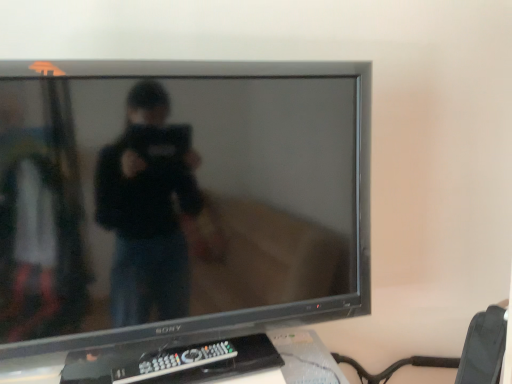
Locate an element on the screen. black plastic remote at lower center is located at coordinates (173, 362).

This screenshot has height=384, width=512. Describe the element at coordinates (173, 362) in the screenshot. I see `black plastic remote at lower center` at that location.

You are a GUI agent. You are given a task and a screenshot of the screen. Output one action in this format:
    pyautogui.click(x=<x>, y=<y>)
    Task: Click on the satin black tv at center
    
    Given the screenshot: What is the action you would take?
    pyautogui.click(x=180, y=215)

This screenshot has height=384, width=512. What do you see at coordinates (180, 215) in the screenshot?
I see `satin black tv at center` at bounding box center [180, 215].

Locate an element on the screen. The height and width of the screenshot is (384, 512). black plastic remote at lower center is located at coordinates (173, 362).

Between black plastic remote at lower center and satin black tv at center, which one appears on the right side from the viewer's perspective?

satin black tv at center is more to the right.

Which object is more forward, black plastic remote at lower center or satin black tv at center?

satin black tv at center is in front.

Does point (212, 354) lie in front of point (103, 230)?

No, (212, 354) is behind (103, 230).

From the image's perspective, relative to satin black tv at center, is black plastic remote at lower center above or below?

Clearly, from the image's perspective, black plastic remote at lower center is below satin black tv at center.

From a real-world perspective, who is located higher, black plastic remote at lower center or satin black tv at center?

satin black tv at center is physically above.

Considering the relative sizes of black plastic remote at lower center and satin black tv at center in the image provided, is black plastic remote at lower center wider than satin black tv at center?

In fact, black plastic remote at lower center might be narrower than satin black tv at center.

Is black plastic remote at lower center shorter than satin black tv at center?

Yes.

Considering the sizes of objects black plastic remote at lower center and satin black tv at center in the image provided, who is smaller, black plastic remote at lower center or satin black tv at center?

black plastic remote at lower center is smaller.

Is satin black tv at center inside black plastic remote at lower center?

No, satin black tv at center is located outside of black plastic remote at lower center.

Are black plastic remote at lower center and satin black tv at center far apart?

No, black plastic remote at lower center is not far away from satin black tv at center.

Is black plastic remote at lower center facing towards satin black tv at center?

Yes, black plastic remote at lower center is turned towards satin black tv at center.

Where is `remote control that appears below the satin black tv at center (from a real-world perspective)`? The height and width of the screenshot is (384, 512). remote control that appears below the satin black tv at center (from a real-world perspective) is located at coordinates (173, 362).

Between satin black tv at center and black plastic remote at lower center, which one appears on the right side from the viewer's perspective?

Positioned to the right is satin black tv at center.

Which object is more forward, satin black tv at center or black plastic remote at lower center?

satin black tv at center is more forward.

Is point (144, 193) closer to viewer compared to point (207, 354)?

Yes, point (144, 193) is closer to viewer.

From the image's perspective, between satin black tv at center and black plastic remote at lower center, which one is located above?

satin black tv at center appears higher in the image.

From a real-world perspective, is satin black tv at center on top of black plastic remote at lower center?

Correct, in the physical world, satin black tv at center is higher than black plastic remote at lower center.

Which object is thinner, satin black tv at center or black plastic remote at lower center?

Thinner between the two is black plastic remote at lower center.

Is satin black tv at center shorter than black plastic remote at lower center?

In fact, satin black tv at center may be taller than black plastic remote at lower center.

Is satin black tv at center bigger or smaller than black plastic remote at lower center?

In the image, satin black tv at center appears to be larger than black plastic remote at lower center.

Would you say satin black tv at center is outside black plastic remote at lower center?

Yes.

Is satin black tv at center with black plastic remote at lower center?

No.

Is satin black tv at center facing away from black plastic remote at lower center?

Correct, satin black tv at center is looking away from black plastic remote at lower center.

Image resolution: width=512 pixels, height=384 pixels. Find the location of `remote control below the satin black tv at center (from the image's perspective)`. remote control below the satin black tv at center (from the image's perspective) is located at coordinates (173, 362).

I want to click on television above the black plastic remote at lower center (from the image's perspective), so click(180, 215).

Where is `television that appears above the black plastic remote at lower center (from a real-world perspective)`? The height and width of the screenshot is (384, 512). television that appears above the black plastic remote at lower center (from a real-world perspective) is located at coordinates point(180,215).